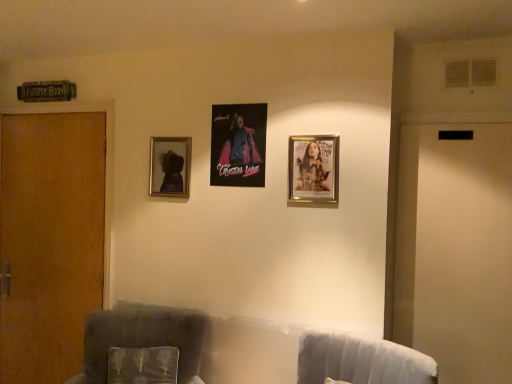
Question: Is matte black portrait at upper left, which is counted as the 1th picture frame, starting from the back, bigger than velvet gray swivel chair at lower right?

Choices:
 (A) no
 (B) yes

Answer: (A)

Question: Can you confirm if matte black portrait at upper left, positioned as the 3th picture frame in right-to-left order, is smaller than velvet gray swivel chair at lower right?

Choices:
 (A) no
 (B) yes

Answer: (B)

Question: Are matte black portrait at upper left, which is counted as the 1th picture frame, starting from the back, and velvet gray swivel chair at lower right far apart?

Choices:
 (A) yes
 (B) no

Answer: (A)

Question: Does matte black portrait at upper left, arranged as the 3th picture frame when viewed from the front, turn towards velvet gray swivel chair at lower right?

Choices:
 (A) no
 (B) yes

Answer: (A)

Question: Is matte black portrait at upper left, positioned as the 3th picture frame in right-to-left order, outside velvet gray swivel chair at lower right?

Choices:
 (A) no
 (B) yes

Answer: (B)

Question: Can you confirm if matte black portrait at upper left, which is counted as the 1th picture frame, starting from the back, is thinner than velvet gray swivel chair at lower right?

Choices:
 (A) yes
 (B) no

Answer: (A)

Question: Could you tell me if velvet gray swivel chair at lower right is facing matte black portrait at upper left, which is the 1th picture frame in left-to-right order?

Choices:
 (A) yes
 (B) no

Answer: (B)

Question: From a real-world perspective, is velvet gray swivel chair at lower right located beneath matte black portrait at upper left, positioned as the 3th picture frame in right-to-left order?

Choices:
 (A) no
 (B) yes

Answer: (B)

Question: Is velvet gray swivel chair at lower right turned away from matte black portrait at upper left, which is the 1th picture frame in left-to-right order?

Choices:
 (A) yes
 (B) no

Answer: (B)

Question: Considering the relative sizes of velvet gray swivel chair at lower right and matte black portrait at upper left, arranged as the 3th picture frame when viewed from the front, in the image provided, is velvet gray swivel chair at lower right wider than matte black portrait at upper left, arranged as the 3th picture frame when viewed from the front,?

Choices:
 (A) yes
 (B) no

Answer: (A)

Question: Is velvet gray swivel chair at lower right not within matte black portrait at upper left, which is counted as the 1th picture frame, starting from the back?

Choices:
 (A) yes
 (B) no

Answer: (A)

Question: Can you confirm if velvet gray swivel chair at lower right is shorter than matte black portrait at upper left, positioned as the 3th picture frame in right-to-left order?

Choices:
 (A) no
 (B) yes

Answer: (B)

Question: From the image's perspective, does velvet dark gray armchair at left appear lower than gold metallic picture frame at upper right, which is counted as the 3th picture frame, starting from the left?

Choices:
 (A) no
 (B) yes

Answer: (B)